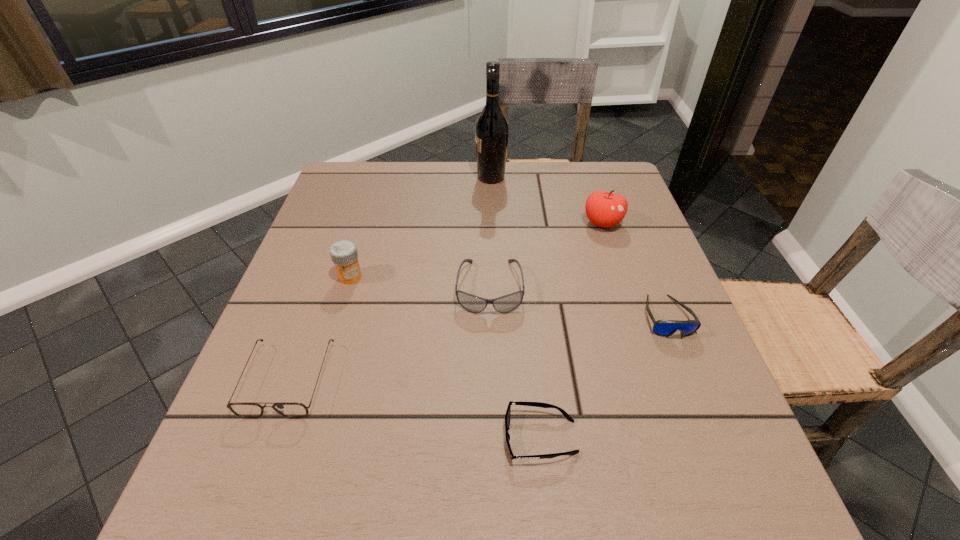
This screenshot has height=540, width=960. I want to click on free space at the near right corner of the desktop, so (708, 468).

Where is `empty space between the shortest object and the medicine`? empty space between the shortest object and the medicine is located at coordinates (445, 357).

Where is `vacant area between the rightmost sunglasses and the second tallest object`? This screenshot has height=540, width=960. vacant area between the rightmost sunglasses and the second tallest object is located at coordinates (635, 270).

This screenshot has width=960, height=540. Find the location of `free space between the medicine and the tallest object`. free space between the medicine and the tallest object is located at coordinates point(420,227).

At what (x,y) coordinates should I click in order to perform the action: click on empty location between the leftmost sunglasses and the fifth shortest object. Please return your answer as a coordinate pair (x, y). Looking at the image, I should click on (320, 328).

Find the location of `vacant area that lies between the rightmost sunglasses and the sixth shortest object`. vacant area that lies between the rightmost sunglasses and the sixth shortest object is located at coordinates (635, 270).

Choose which object is the sixth nearest neighbor to the wine bottle. Please provide its 2D coordinates. Your answer should be formatted as a tuple, i.e. [(x, y)], where the tuple contains the x and y coordinates of a point satisfying the conditions above.

[(536, 404)]

Locate which object ranks fourth in proximity to the rightmost sunglasses. Please provide its 2D coordinates. Your answer should be formatted as a tuple, i.e. [(x, y)], where the tuple contains the x and y coordinates of a point satisfying the conditions above.

[(491, 128)]

Identify the location of sunglasses that is the closest to the leftmost sunglasses. The height and width of the screenshot is (540, 960). (504, 304).

Image resolution: width=960 pixels, height=540 pixels. Identify the location of the closest sunglasses relative to the leftmost sunglasses. (504, 304).